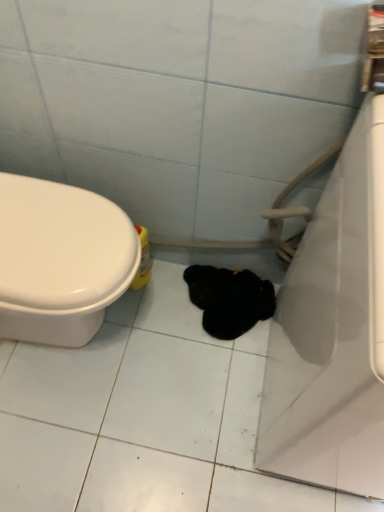
Question: Are black fuzzy animal at center and yellow plastic bottle at lower left making contact?

Choices:
 (A) no
 (B) yes

Answer: (A)

Question: Does black fuzzy animal at center have a smaller size compared to yellow plastic bottle at lower left?

Choices:
 (A) no
 (B) yes

Answer: (A)

Question: Is black fuzzy animal at center at the right side of yellow plastic bottle at lower left?

Choices:
 (A) yes
 (B) no

Answer: (A)

Question: From a real-world perspective, is black fuzzy animal at center physically below yellow plastic bottle at lower left?

Choices:
 (A) no
 (B) yes

Answer: (B)

Question: Considering the relative sizes of black fuzzy animal at center and yellow plastic bottle at lower left in the image provided, is black fuzzy animal at center wider than yellow plastic bottle at lower left?

Choices:
 (A) yes
 (B) no

Answer: (A)

Question: From a real-world perspective, is black fuzzy animal at center above or below white glossy bathtub at right?

Choices:
 (A) below
 (B) above

Answer: (A)

Question: From the image's perspective, is black fuzzy animal at center located above or below white glossy bathtub at right?

Choices:
 (A) below
 (B) above

Answer: (B)

Question: Would you say black fuzzy animal at center is to the left or to the right of white glossy bathtub at right in the picture?

Choices:
 (A) right
 (B) left

Answer: (B)

Question: In the image, is black fuzzy animal at center positioned in front of or behind white glossy bathtub at right?

Choices:
 (A) front
 (B) behind

Answer: (B)

Question: In the image, is white glossy bathtub at right positioned in front of or behind yellow plastic bottle at lower left?

Choices:
 (A) front
 (B) behind

Answer: (A)

Question: From a real-world perspective, is white glossy bathtub at right positioned above or below yellow plastic bottle at lower left?

Choices:
 (A) below
 (B) above

Answer: (B)

Question: Based on their positions, is white glossy bathtub at right located to the left or right of yellow plastic bottle at lower left?

Choices:
 (A) left
 (B) right

Answer: (B)

Question: Is point (347, 217) closer or farther from the camera than point (137, 274)?

Choices:
 (A) closer
 (B) farther

Answer: (A)

Question: Is white glossy bathtub at right wider or thinner than black fuzzy animal at center?

Choices:
 (A) wide
 (B) thin

Answer: (A)

Question: In terms of size, does white glossy bathtub at right appear bigger or smaller than black fuzzy animal at center?

Choices:
 (A) big
 (B) small

Answer: (A)